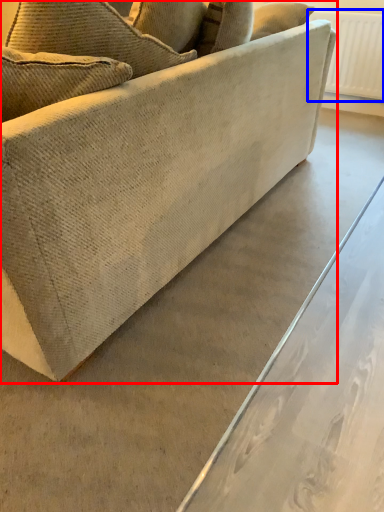
Question: Which object appears closest to the camera in this image, studio couch (highlighted by a red box) or radiator (highlighted by a blue box)?

Choices:
 (A) studio couch
 (B) radiator

Answer: (A)